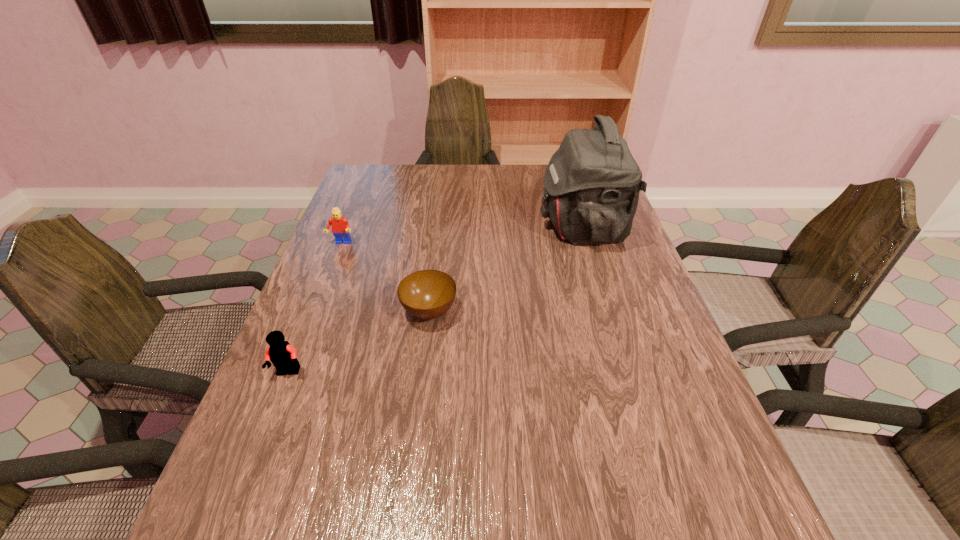
Locate an element on the screen. The image size is (960, 540). shoulder bag is located at coordinates (592, 182).

Where is `the rightmost object`? This screenshot has width=960, height=540. the rightmost object is located at coordinates (592, 182).

Where is `the nearer Lego`? This screenshot has height=540, width=960. the nearer Lego is located at coordinates (283, 356).

Find the location of a particular element. the farther Lego is located at coordinates (339, 224).

You are a GUI agent. You are given a task and a screenshot of the screen. Output one action in this format:
    pyautogui.click(x=<x>, y=<y>)
    Task: Click on the second object from right to left
    This screenshot has height=540, width=960.
    Given the screenshot: What is the action you would take?
    pyautogui.click(x=427, y=294)

Image resolution: width=960 pixels, height=540 pixels. I want to click on the shortest object, so [427, 294].

Locate an element on the screen. This screenshot has height=540, width=960. free space located on the open flap of the rightmost object is located at coordinates (468, 227).

This screenshot has height=540, width=960. Find the location of `vacant position located 0.340m on the open flap of the rightmost object`. vacant position located 0.340m on the open flap of the rightmost object is located at coordinates [423, 227].

What are the coordinates of `blank space located 0.180m on the open flap of the rightmost object` in the screenshot? It's located at (478, 227).

This screenshot has height=540, width=960. In order to click on vacant space located 0.080m on the front-facing side of the nearest object in this screenshot , I will do `click(271, 417)`.